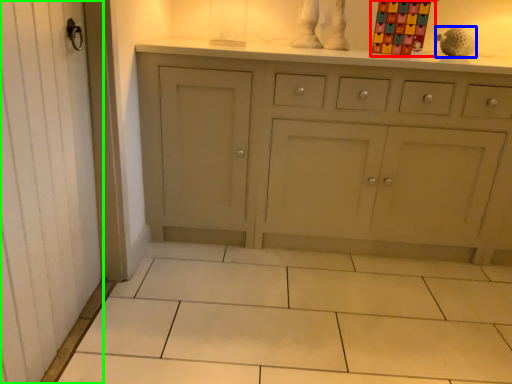
Question: Estimate the real-world distances between objects in this image. Which object is farther from toy (highlighted by a red box), toy (highlighted by a blue box) or screen door (highlighted by a green box)?

Choices:
 (A) toy
 (B) screen door

Answer: (B)